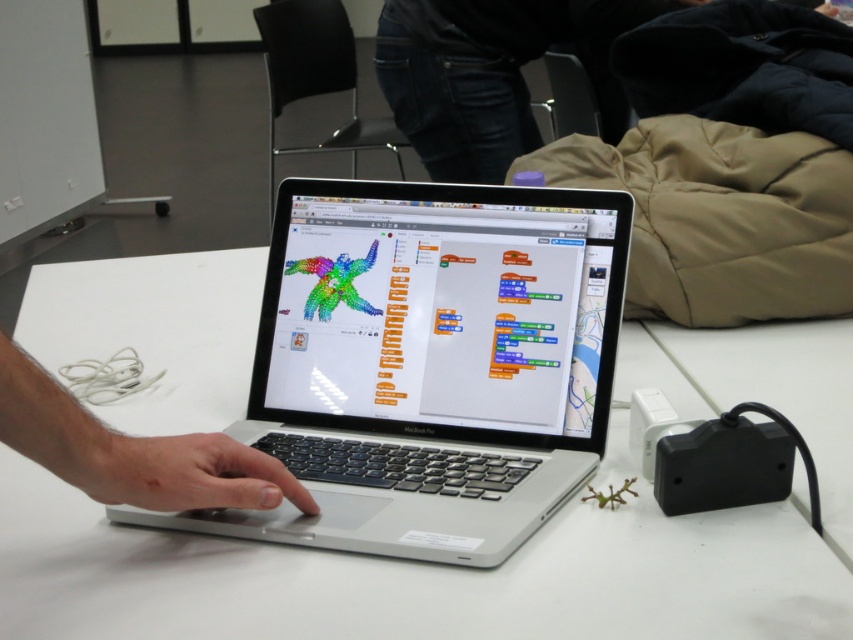
You are organizing a classroom and need to place a new monitor on the table. The monitor requires 30 cm of space to the left of the silver metallic laptop at center. Is there enough space on the white glossy table at center for this?

The white glossy table at center is positioned on the left side of the silver metallic laptop at center. Since the table is to the left of the laptop, there is sufficient space available on the white glossy table at center to accommodate the monitor requiring 30 cm of space to the left of the silver metallic laptop at center.

You are a student trying to reach the power strip on the white glossy table at center. There is a matte black hand at center in the way. Can you move your hand to access the power strip without moving the hand?

The white glossy table at center is above the matte black hand at center, so you can reach the power strip on the table without needing to move the hand.